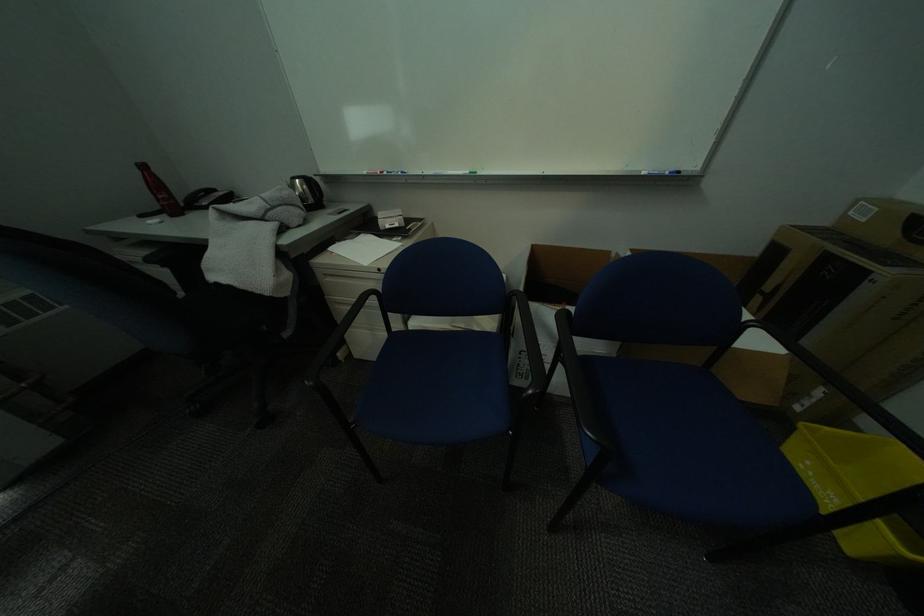
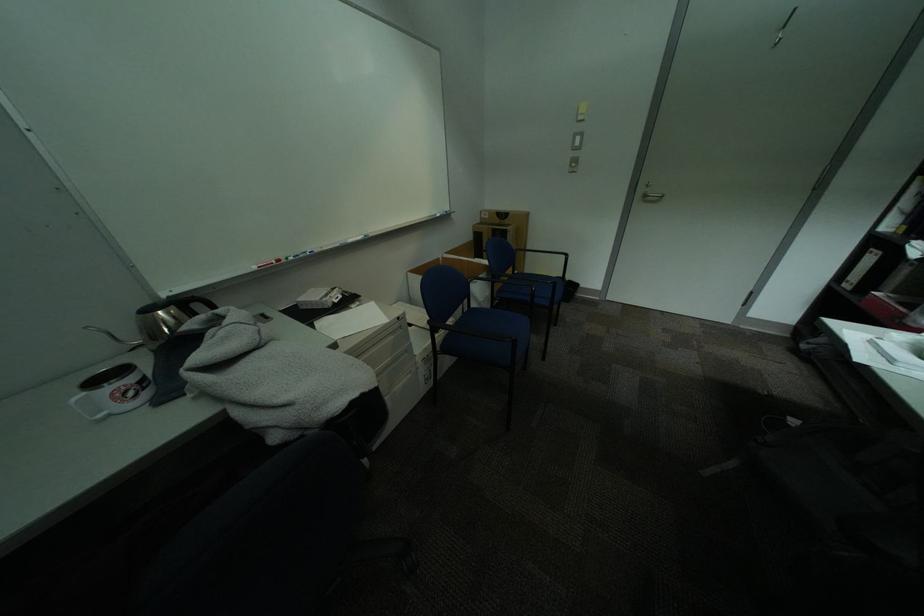
Locate, in the second image, the point that corresponds to point 322,179 in the first image.

(204, 297)